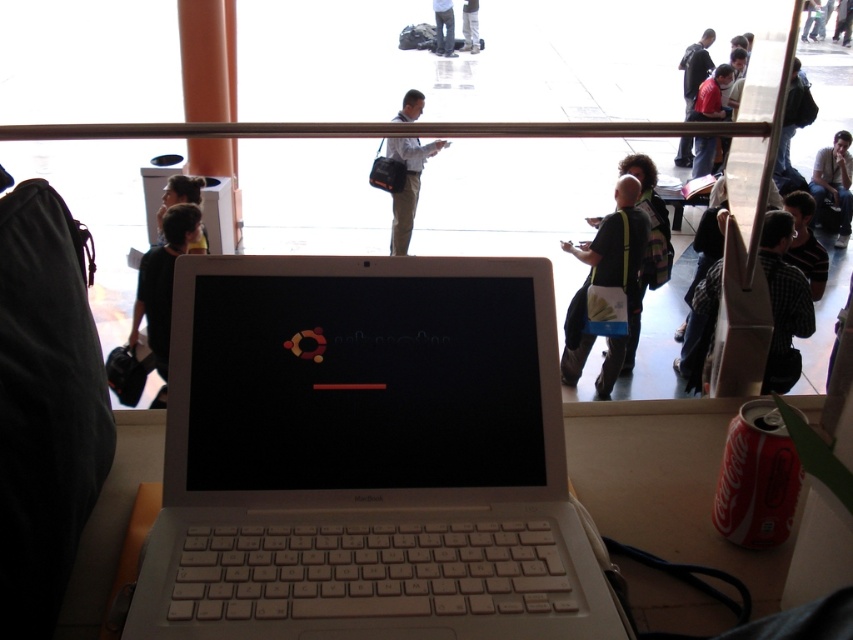
Who is higher up, dark blue shirt at center or white fabric pants at center?

white fabric pants at center is higher up.

Is the position of dark blue shirt at center less distant than that of white fabric pants at center?

Yes, dark blue shirt at center is closer to the viewer.

Between point (689, 147) and point (479, 48), which one is positioned behind?

Positioned behind is point (479, 48).

Where is `dark blue shirt at center`? dark blue shirt at center is located at coordinates (695, 67).

Is red shirt at upper right shorter than dark blue jeans at center?

Indeed, red shirt at upper right has a lesser height compared to dark blue jeans at center.

In order to click on red shirt at upper right in this screenshot , I will do `click(711, 96)`.

This screenshot has height=640, width=853. I want to click on red shirt at upper right, so click(x=711, y=96).

Identify the location of red shirt at upper right. Image resolution: width=853 pixels, height=640 pixels. (711, 96).

Who is shorter, light brown leather jacket at upper right or white fabric pants at center?

With less height is white fabric pants at center.

Who is taller, light brown leather jacket at upper right or white fabric pants at center?

With more height is light brown leather jacket at upper right.

Which is in front, point (840, 189) or point (467, 33)?

Positioned in front is point (840, 189).

You are a GUI agent. You are given a task and a screenshot of the screen. Output one action in this format:
    pyautogui.click(x=<x>, y=<y>)
    Task: Click on the light brown leather jacket at upper right
    
    Given the screenshot: What is the action you would take?
    pyautogui.click(x=834, y=182)